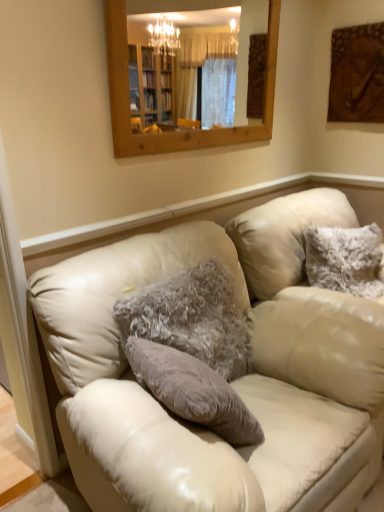
Question: Would you say wooden textured painting at upper right is to the left or to the right of fuzzy gray pillow at center, which is counted as the first pillow, starting from the left, in the picture?

Choices:
 (A) left
 (B) right

Answer: (B)

Question: Looking at their shapes, would you say wooden textured painting at upper right is wider or thinner than fuzzy gray pillow at center, which is counted as the 1th pillow, starting from the front?

Choices:
 (A) thin
 (B) wide

Answer: (A)

Question: Estimate the real-world distances between objects in this image. Which object is farther from the leather couch at center?

Choices:
 (A) fuzzy white pillow at upper right, positioned as the 1th pillow in right-to-left order
 (B) wooden textured painting at upper right
 (C) fuzzy gray pillow at center, which is counted as the first pillow, starting from the left
 (D) wooden frame mirror at upper center

Answer: (D)

Question: Estimate the real-world distances between objects in this image. Which object is closer to the wooden textured painting at upper right?

Choices:
 (A) wooden frame mirror at upper center
 (B) fuzzy white pillow at upper right, the 1th pillow positioned from the back
 (C) leather couch at center
 (D) fuzzy gray pillow at center, which is counted as the 1th pillow, starting from the front

Answer: (B)